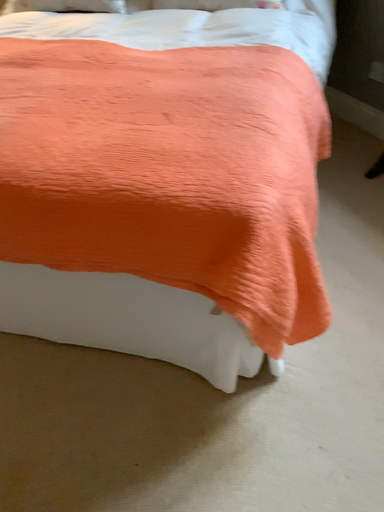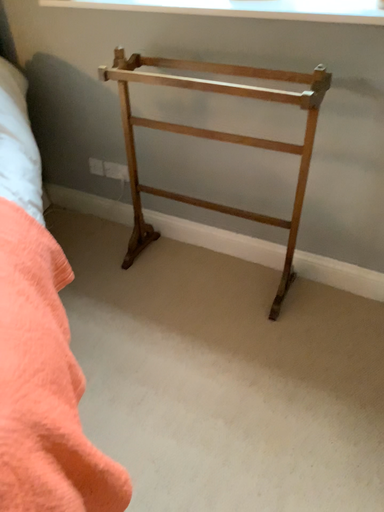
Question: How did the camera likely rotate when shooting the video?

Choices:
 (A) rotated upward
 (B) rotated downward

Answer: (A)